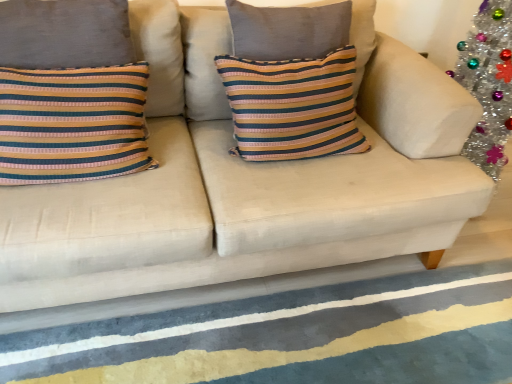
Question: Would you say striped fabric pillow at center is outside textured blue rug at lower center?

Choices:
 (A) no
 (B) yes

Answer: (B)

Question: From the image's perspective, does striped fabric pillow at center appear lower than textured blue rug at lower center?

Choices:
 (A) no
 (B) yes

Answer: (A)

Question: Considering the relative sizes of striped fabric pillow at center and textured blue rug at lower center in the image provided, is striped fabric pillow at center bigger than textured blue rug at lower center?

Choices:
 (A) yes
 (B) no

Answer: (A)

Question: Is striped fabric pillow at center beside textured blue rug at lower center?

Choices:
 (A) no
 (B) yes

Answer: (A)

Question: Does striped fabric pillow at center appear on the right side of textured blue rug at lower center?

Choices:
 (A) no
 (B) yes

Answer: (A)

Question: Is striped fabric pillow at center thinner than textured blue rug at lower center?

Choices:
 (A) yes
 (B) no

Answer: (A)

Question: Is there a large distance between textured blue rug at lower center and striped fabric pillow at center?

Choices:
 (A) yes
 (B) no

Answer: (B)

Question: From the image's perspective, is textured blue rug at lower center over striped fabric pillow at center?

Choices:
 (A) no
 (B) yes

Answer: (A)

Question: Is textured blue rug at lower center thinner than striped fabric pillow at center?

Choices:
 (A) yes
 (B) no

Answer: (B)

Question: From the image's perspective, does textured blue rug at lower center appear lower than striped fabric pillow at center?

Choices:
 (A) yes
 (B) no

Answer: (A)

Question: Is textured blue rug at lower center taller than striped fabric pillow at center?

Choices:
 (A) yes
 (B) no

Answer: (B)

Question: Is textured blue rug at lower center positioned with its back to striped fabric pillow at center?

Choices:
 (A) no
 (B) yes

Answer: (A)

Question: Considering the positions of point (52, 357) and point (237, 92), is point (52, 357) closer or farther from the camera than point (237, 92)?

Choices:
 (A) closer
 (B) farther

Answer: (A)